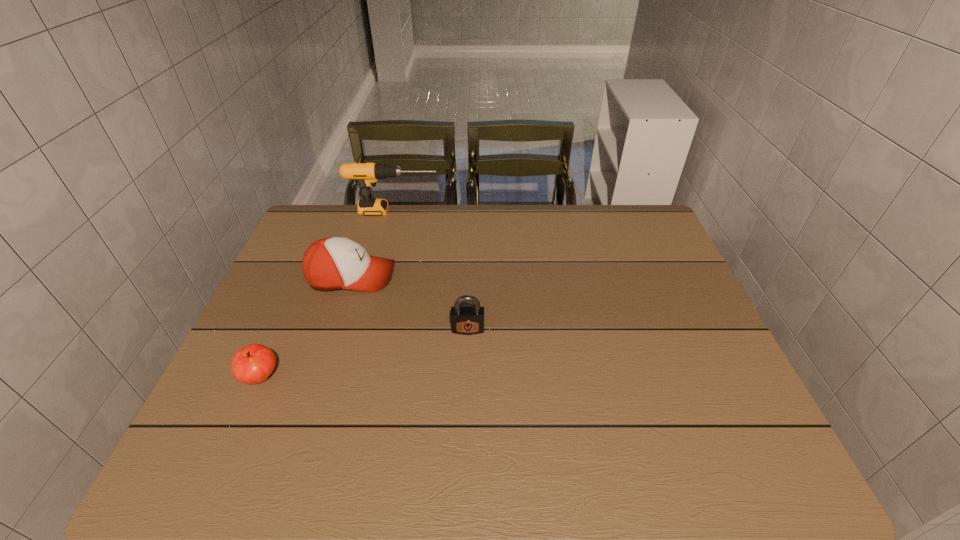
The height and width of the screenshot is (540, 960). Identify the location of vacant region at the far left corner of the desktop. (328, 225).

Where is `free space between the apple and the padlock`? The height and width of the screenshot is (540, 960). free space between the apple and the padlock is located at coordinates (365, 353).

This screenshot has height=540, width=960. Find the location of `free space between the drill and the nearest object`. free space between the drill and the nearest object is located at coordinates (327, 294).

This screenshot has height=540, width=960. What are the coordinates of `free space that is in between the apple and the tallest object` in the screenshot? It's located at tap(327, 294).

The height and width of the screenshot is (540, 960). I want to click on vacant point located between the tallest object and the nearest object, so click(x=327, y=294).

Locate an element on the screen. The image size is (960, 540). vacant region between the padlock and the drill is located at coordinates (431, 270).

Locate an element on the screen. The height and width of the screenshot is (540, 960). vacant area that lies between the baseball cap and the drill is located at coordinates (372, 244).

Find the location of a particular element. The height and width of the screenshot is (540, 960). free space between the rightmost object and the second farthest object is located at coordinates (410, 303).

Locate an element on the screen. vacant point located between the baseball cap and the apple is located at coordinates (306, 327).

Identify the location of vacant space in between the third nearest object and the tallest object. Image resolution: width=960 pixels, height=540 pixels. (372, 244).